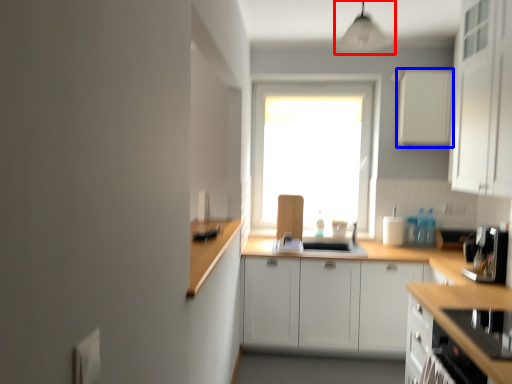
Question: Among these objects, which one is nearest to the camera, light fixture (highlighted by a red box) or appliance (highlighted by a blue box)?

Choices:
 (A) light fixture
 (B) appliance

Answer: (A)